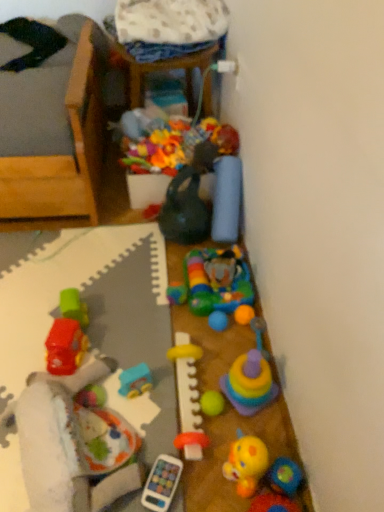
In order to click on free space in front of green rubber ball at center, which appears as the 5th toy when viewed from the left in this screenshot , I will do `click(221, 458)`.